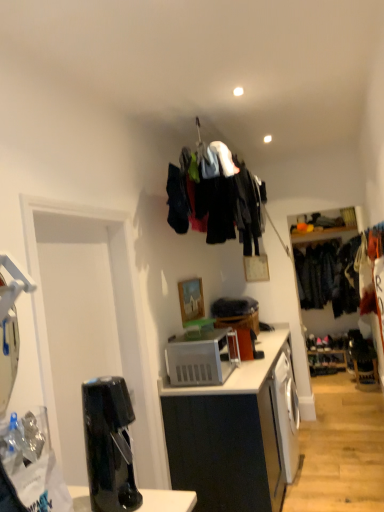
Question: From a real-world perspective, is dark blue fabric at right, positioned as the first clothing in back-to-front order, above or below black glossy coffee machine at lower left?

Choices:
 (A) below
 (B) above

Answer: (B)

Question: Is dark blue fabric at right, which is the first clothing from right to left, situated inside black glossy coffee machine at lower left or outside?

Choices:
 (A) outside
 (B) inside

Answer: (A)

Question: Which object is positioned farthest from the dark fabric clothes at upper center, which ranks as the second clothing in right-to-left order?

Choices:
 (A) white matte cabinet at center
 (B) black glossy coffee machine at lower left
 (C) wooden picture frame at center
 (D) dark blue fabric at right, which is the first clothing from right to left
 (E) white plastic microwave oven at center

Answer: (D)

Question: Estimate the real-world distances between objects in this image. Which object is farther from the black glossy coffee machine at lower left?

Choices:
 (A) white matte cabinet at center
 (B) wooden picture frame at center
 (C) white plastic microwave oven at center
 (D) dark blue fabric at right, which is the first clothing from right to left
 (E) dark fabric clothes at upper center, positioned as the 2th clothing in back-to-front order

Answer: (D)